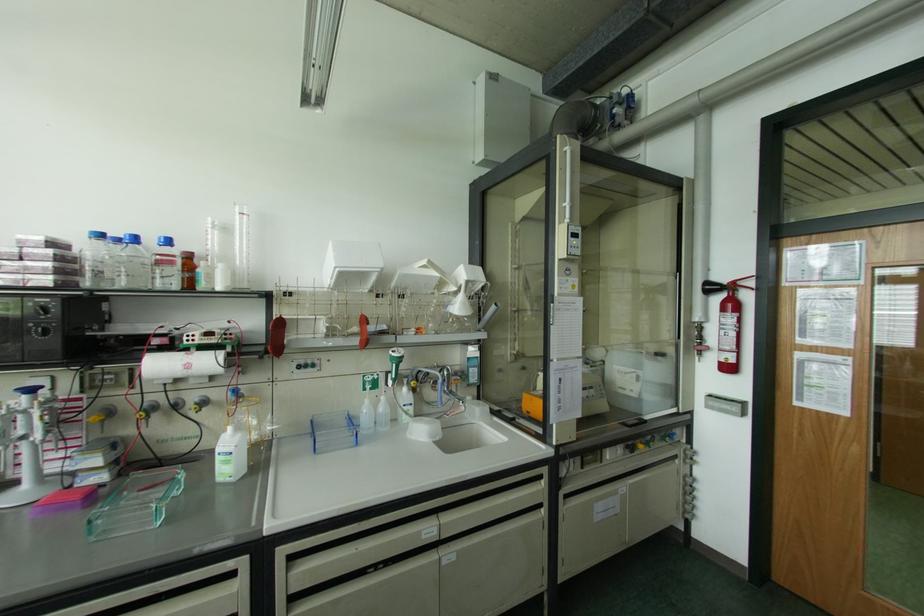
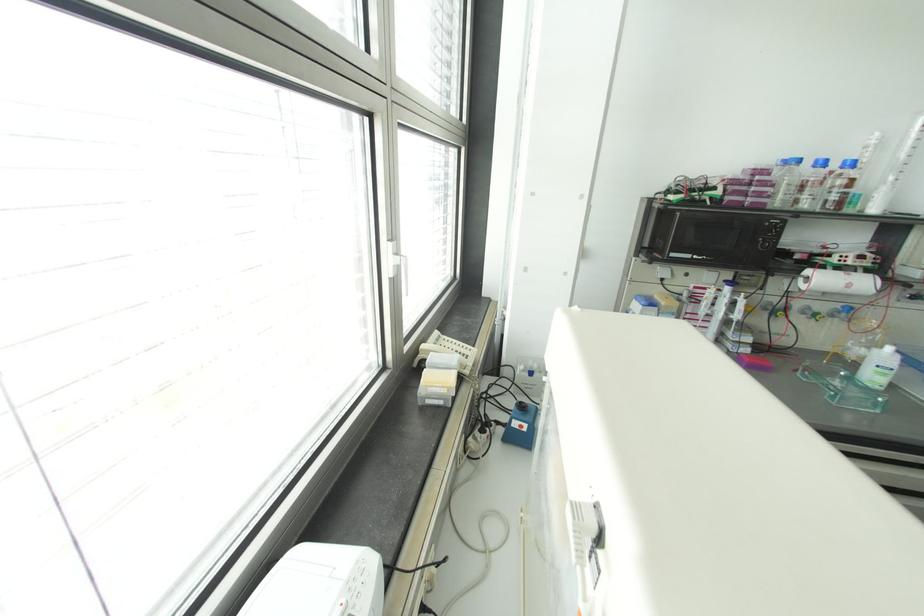
Locate, in the second image, the point that corresponds to point (238, 435) in the first image.

(898, 355)